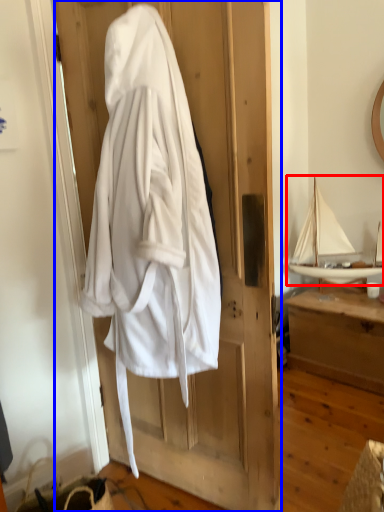
Question: Which point is further to the camera, boat (highlighted by a red box) or door (highlighted by a blue box)?

Choices:
 (A) boat
 (B) door

Answer: (A)